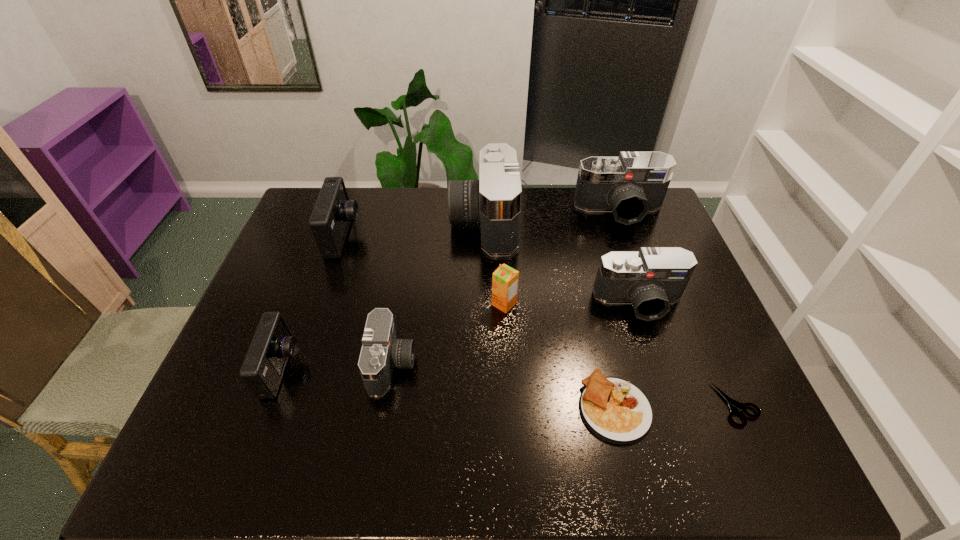
You are a GUI agent. You are given a task and a screenshot of the screen. Output one action in this format:
    pyautogui.click(x=<x>, y=<y>)
    Task: Click on the omelet
    The width and height of the screenshot is (960, 540).
    Given the screenshot: What is the action you would take?
    pyautogui.click(x=614, y=409)

This screenshot has width=960, height=540. Identify the location of the shortest object. (734, 405).

Find the location of `vacant region located 0.150m on the front-facing side of the second black camera from left to right`. vacant region located 0.150m on the front-facing side of the second black camera from left to right is located at coordinates (406, 221).

Image resolution: width=960 pixels, height=540 pixels. I want to click on vacant space located on the front-facing side of the second black camera from left to right, so click(423, 221).

This screenshot has width=960, height=540. I want to click on free point located 0.140m on the front-facing side of the second black camera from left to right, so click(x=409, y=221).

The width and height of the screenshot is (960, 540). I want to click on vacant area situated 0.370m on the front-facing side of the second biggest black camera, so click(x=658, y=312).

Identify the location of vacant space located on the front-facing side of the bigger blue camera. This screenshot has width=960, height=540. pos(467,237).

The height and width of the screenshot is (540, 960). I want to click on free point located on the front-facing side of the fourth farthest camera, so click(661, 368).

The height and width of the screenshot is (540, 960). Find the location of `vacant space located 0.250m on the left of the orange juice`. vacant space located 0.250m on the left of the orange juice is located at coordinates (402, 304).

Locate an element on the screen. vacant region located on the front-facing side of the smaller blue camera is located at coordinates (356, 369).